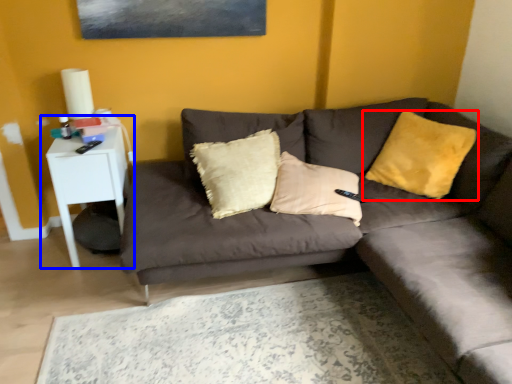
Question: Among these objects, which one is farthest to the camera, pillow (highlighted by a red box) or table (highlighted by a blue box)?

Choices:
 (A) pillow
 (B) table

Answer: (B)